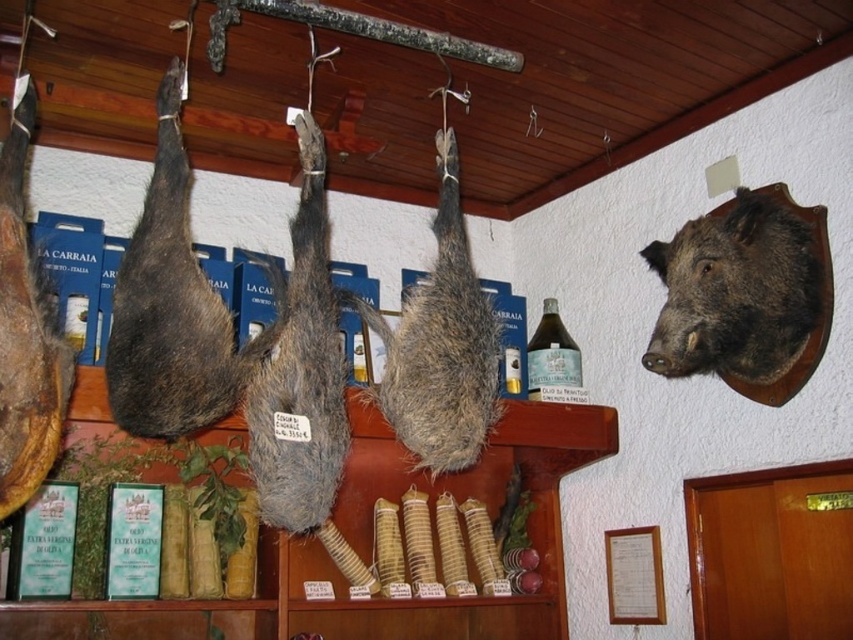
You are a delivery person with a box that is 1.5 meters long. You need to place it between the dark brown fur head at upper right and the camera. Is there enough space?

The distance between the dark brown fur head at upper right and the camera is 1.58 meters, so the box which is 1.5 meters long can fit in that space.

You are a customer in the shop and want to grab both the dark brown fur head at upper right and the brown leather ham at left. If you can only reach up to 1.2 meters, can you reach both items without any assistance?

The dark brown fur head at upper right is 1.35 meters from brown leather ham at left. Since you can only reach up to 1.2 meters, you cannot reach the dark brown fur head at upper right without assistance.

You are a customer in the shop and want to touch both the fuzzy fur pig at center and the fuzzy fur boar at center. Which one can you reach without moving your position?

The fuzzy fur pig at center is in front of the fuzzy fur boar at center, so you can reach the fuzzy fur pig at center without moving.